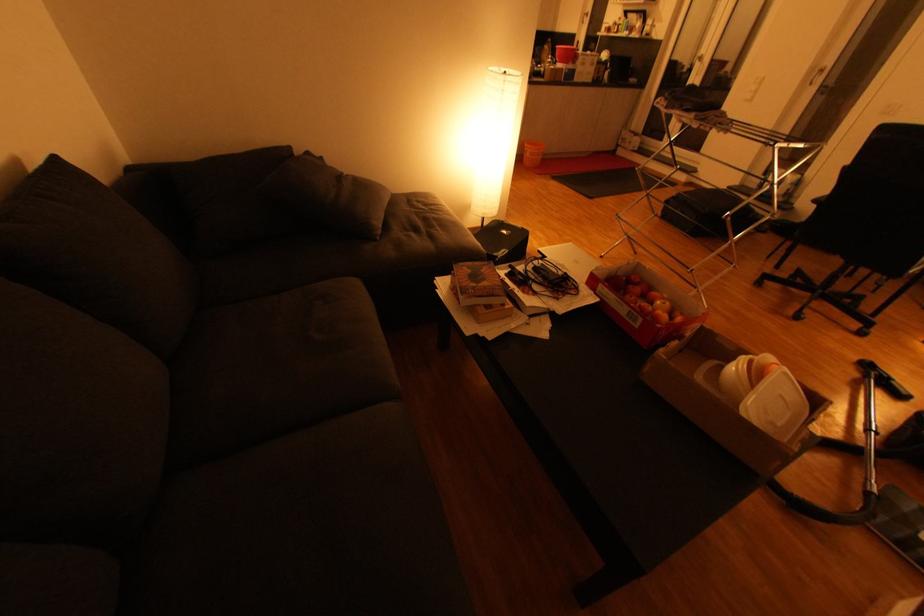
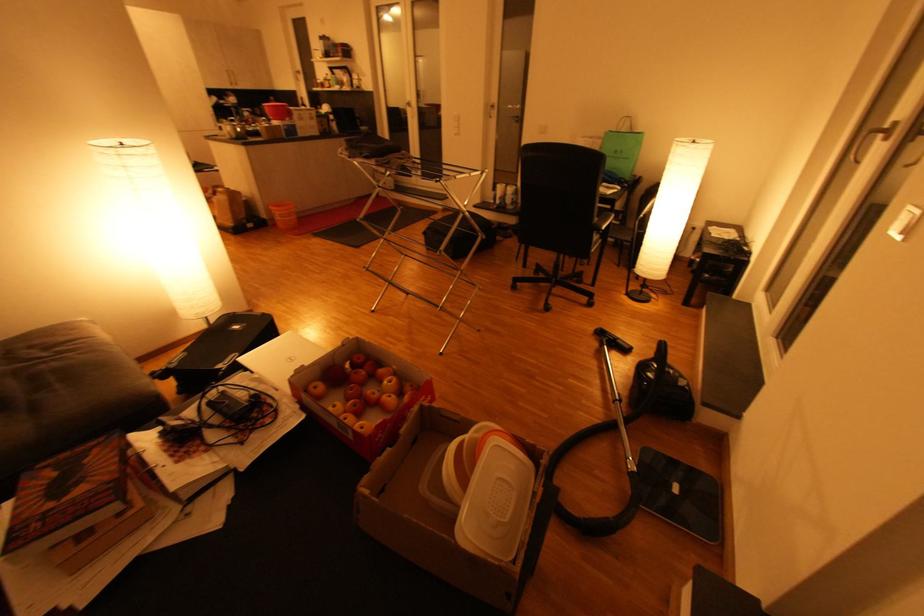
The point at [669,304] is marked in the first image. Where is the corresponding point in the second image?

(395, 382)